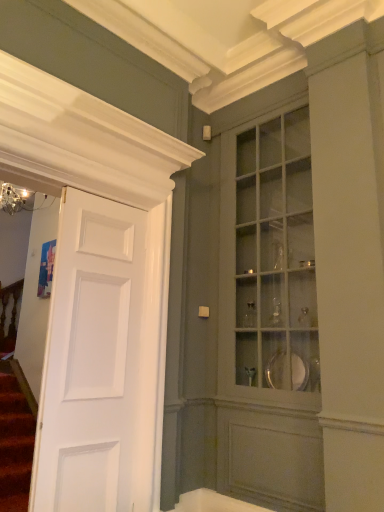
Question: Should I look upward or downward to see matte glass cabinet at center?

Choices:
 (A) down
 (B) up

Answer: (A)

Question: From the image's perspective, is white glossy bathtub at lower center below white matte door at left?

Choices:
 (A) no
 (B) yes

Answer: (B)

Question: Can you see white glossy bathtub at lower center touching white matte door at left?

Choices:
 (A) yes
 (B) no

Answer: (B)

Question: Is white glossy bathtub at lower center far from white matte door at left?

Choices:
 (A) yes
 (B) no

Answer: (B)

Question: Is the depth of white glossy bathtub at lower center greater than that of white matte door at left?

Choices:
 (A) yes
 (B) no

Answer: (A)

Question: Considering the relative sizes of white glossy bathtub at lower center and white matte door at left in the image provided, is white glossy bathtub at lower center smaller than white matte door at left?

Choices:
 (A) no
 (B) yes

Answer: (B)

Question: Considering the relative positions of white glossy bathtub at lower center and white matte door at left in the image provided, is white glossy bathtub at lower center to the right of white matte door at left from the viewer's perspective?

Choices:
 (A) no
 (B) yes

Answer: (B)

Question: From a real-world perspective, does white glossy bathtub at lower center stand above matte glass cabinet at center?

Choices:
 (A) yes
 (B) no

Answer: (B)

Question: Does white glossy bathtub at lower center lie in front of matte glass cabinet at center?

Choices:
 (A) no
 (B) yes

Answer: (A)

Question: Considering the relative positions of white glossy bathtub at lower center and matte glass cabinet at center in the image provided, is white glossy bathtub at lower center behind matte glass cabinet at center?

Choices:
 (A) yes
 (B) no

Answer: (A)

Question: From the image's perspective, is white glossy bathtub at lower center on matte glass cabinet at center?

Choices:
 (A) yes
 (B) no

Answer: (B)

Question: Is white glossy bathtub at lower center outside matte glass cabinet at center?

Choices:
 (A) yes
 (B) no

Answer: (A)

Question: Does white glossy bathtub at lower center appear on the left side of matte glass cabinet at center?

Choices:
 (A) yes
 (B) no

Answer: (A)

Question: Can you confirm if white matte door at left is thinner than matte glass cabinet at center?

Choices:
 (A) no
 (B) yes

Answer: (B)